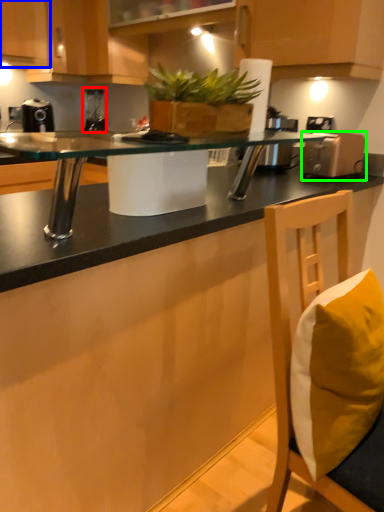
Question: Which object is the farthest from coffee machine (highlighted by a red box)? Choose among these: cabinetry (highlighted by a blue box) or appliance (highlighted by a green box).

Choices:
 (A) cabinetry
 (B) appliance

Answer: (B)